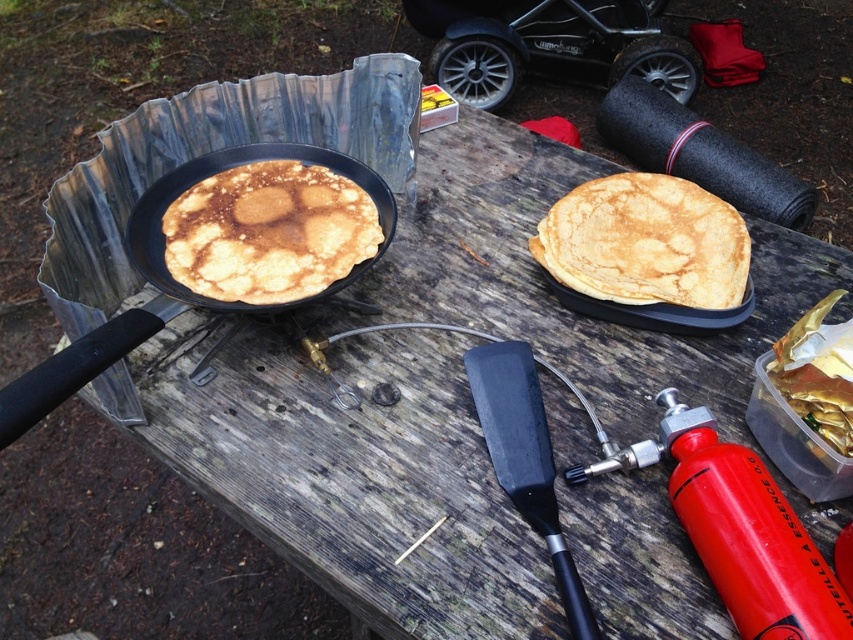
Question: Among these points, which one is nearest to the camera?

Choices:
 (A) (476, 28)
 (B) (242, 236)
 (C) (703, 256)

Answer: (B)

Question: Estimate the real-world distances between objects in this image. Which object is closer to the matte black frying pan at left?

Choices:
 (A) golden brown pancake at center
 (B) golden matte pancake at left

Answer: (B)

Question: Is golden matte pancake at left to the right of black rubber baby carriage at upper center from the viewer's perspective?

Choices:
 (A) yes
 (B) no

Answer: (B)

Question: Can you confirm if black rubber baby carriage at upper center is positioned to the left of matte black frying pan at left?

Choices:
 (A) no
 (B) yes

Answer: (A)

Question: Is the position of golden brown pancake at center less distant than that of black rubber baby carriage at upper center?

Choices:
 (A) no
 (B) yes

Answer: (B)

Question: Which of the following is the farthest from the observer?

Choices:
 (A) black rubber baby carriage at upper center
 (B) matte black frying pan at left

Answer: (A)